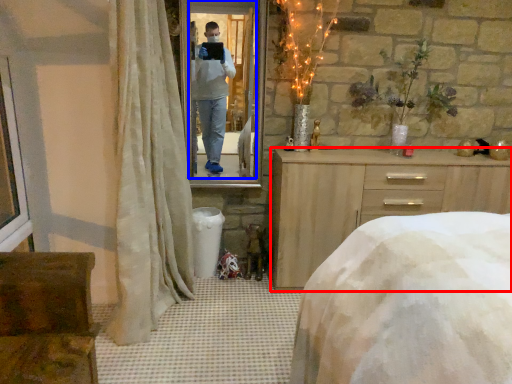
Question: Which point is further to the camera, chest of drawers (highlighted by a red box) or mirror (highlighted by a blue box)?

Choices:
 (A) chest of drawers
 (B) mirror

Answer: (B)